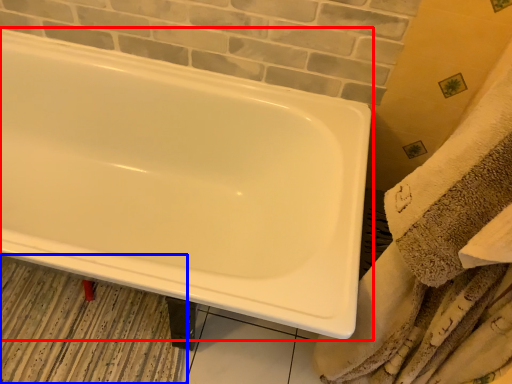
Question: Which object appears closest to the camera in this image, bathtub (highlighted by a red box) or bath mat (highlighted by a blue box)?

Choices:
 (A) bathtub
 (B) bath mat

Answer: (A)